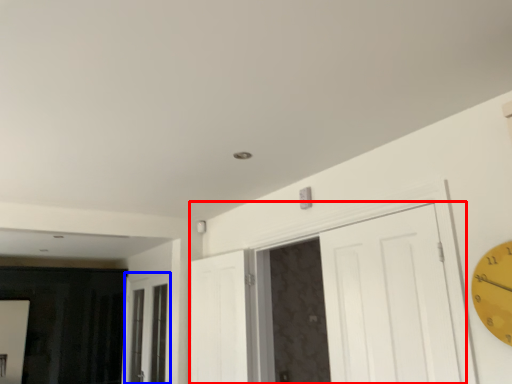
Question: Among these objects, which one is nearest to the camera, door (highlighted by a red box) or window (highlighted by a blue box)?

Choices:
 (A) door
 (B) window

Answer: (A)